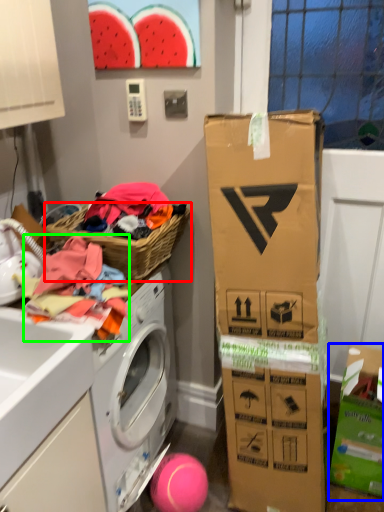
Question: Which object is positioned farthest from picnic basket (highlighted by a red box)? Select from cardboard box (highlighted by a blue box) and clothing (highlighted by a green box).

Choices:
 (A) cardboard box
 (B) clothing

Answer: (A)